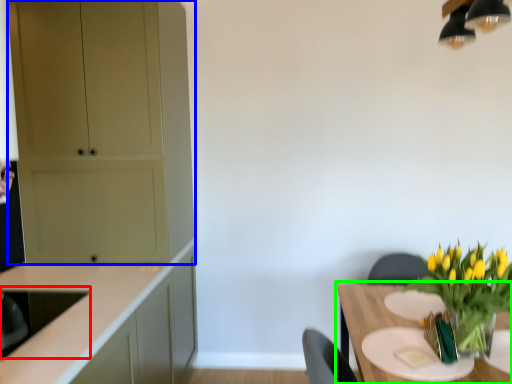
Question: Considering the real-world distances, which object is farthest from sink (highlighted by a red box)? cabinetry (highlighted by a blue box) or table (highlighted by a green box)?

Choices:
 (A) cabinetry
 (B) table

Answer: (B)